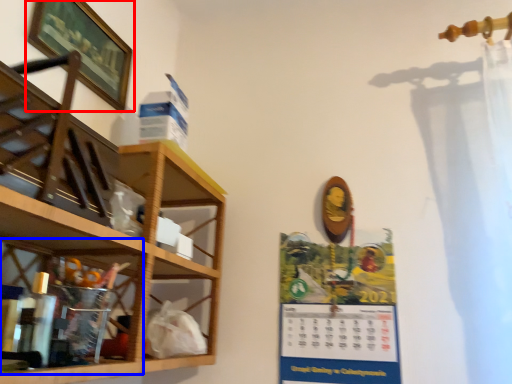
Question: Which point is further to the camera, picture frame (highlighted by a red box) or cabinet (highlighted by a blue box)?

Choices:
 (A) picture frame
 (B) cabinet

Answer: (A)